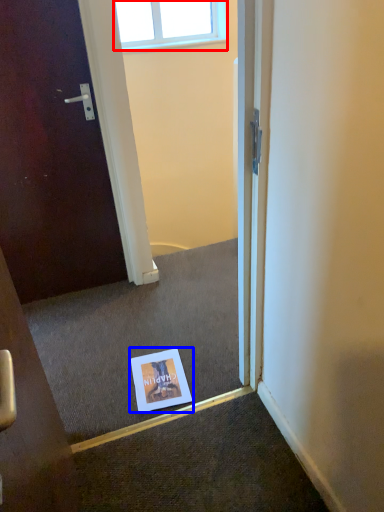
Question: Which object is further to the camera taking this photo, window (highlighted by a red box) or flyer (highlighted by a blue box)?

Choices:
 (A) window
 (B) flyer

Answer: (A)